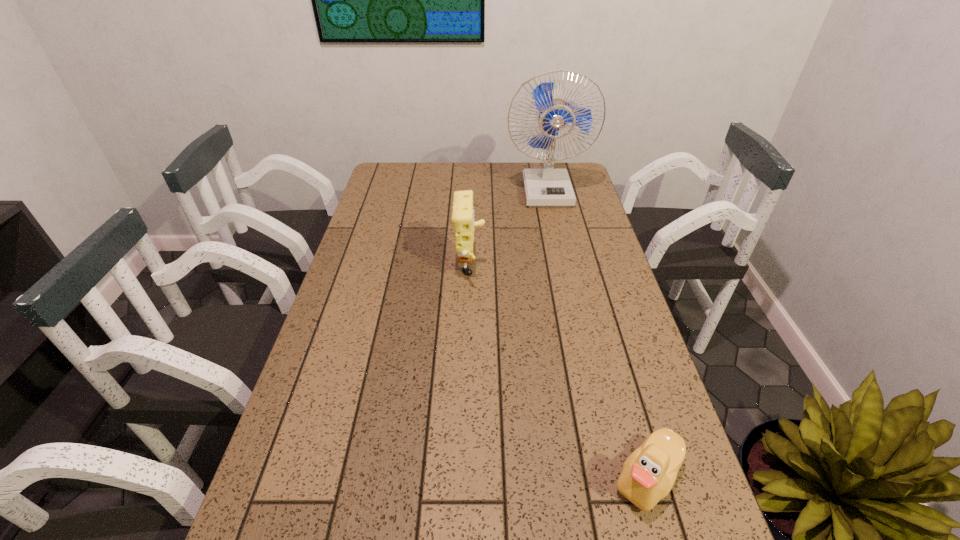
Where is `vacant space located 0.090m at the beak of the nearest object`? vacant space located 0.090m at the beak of the nearest object is located at coordinates (564, 478).

The image size is (960, 540). I want to click on object present at the far edge, so click(547, 187).

What are the coordinates of `fan at the right edge` in the screenshot? It's located at (547, 187).

Find the location of a particular element. duck present at the right edge is located at coordinates (649, 473).

Identify the location of object positioned at the far right corner. The height and width of the screenshot is (540, 960). point(547,187).

Locate an element on the screen. Image resolution: width=960 pixels, height=540 pixels. vacant space at the far edge of the desktop is located at coordinates (426, 192).

In the image, there is a desktop. Where is `free region at the left edge`? The width and height of the screenshot is (960, 540). free region at the left edge is located at coordinates (389, 259).

The image size is (960, 540). What are the coordinates of `vacant area at the right edge of the desktop` in the screenshot? It's located at (588, 260).

Locate an element on the screen. free space between the tallest object and the shortest object is located at coordinates (596, 334).

The height and width of the screenshot is (540, 960). I want to click on free space between the fan and the nearest object, so click(x=596, y=334).